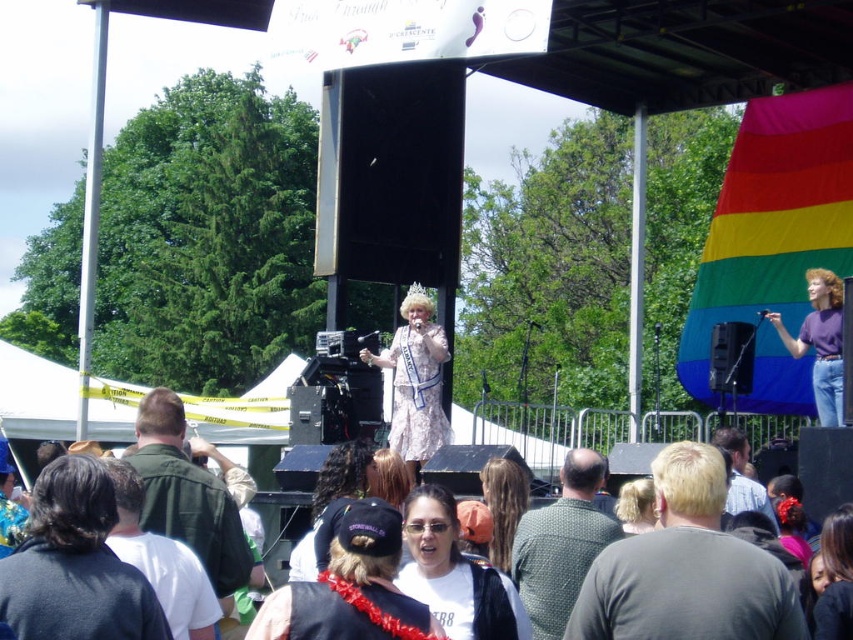
You are attending a festival and notice two performers on stage. One has dark brown hair at lower left and the other is wearing a green dotted shirt at center. According to the description, which performer is positioned more to the left?

The dark brown hair at lower left is positioned to the left of the green dotted shirt at center, so the performer with dark brown hair at lower left is more to the left.

You are attending the festival and want to take a photo of both the dark brown hair at lower left and the green dotted shirt at center. Based on their sizes in the image, which one should you focus on first to ensure they are both in frame?

The dark brown hair at lower left is larger in width than the green dotted shirt at center, so you should focus on the dark brown hair at lower left first to ensure both fit in the frame.

You are an event photographer at the festival. You need to capture a photo that includes both the green matte jacket at left and the blonde hair at center. Which object should you focus on first to ensure both are in frame?

The green matte jacket at left is bigger than the blonde hair at center, so you should focus on the green matte jacket at left first to ensure both are in frame.